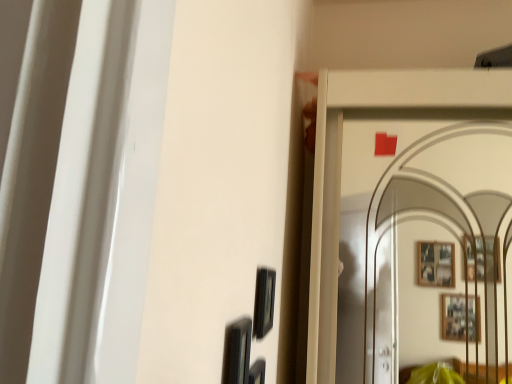
How much space does matte black picture frame at center, the second picture frame in the front-to-back sequence, occupy vertically?

It is 5.50 inches.

In order to click on matte black picture frame at center, the second picture frame in the front-to-back sequence in this screenshot , I will do `click(264, 301)`.

Describe the element at coordinates (264, 301) in the screenshot. I see `matte black picture frame at center, positioned as the 1th picture frame in back-to-front order` at that location.

What do you see at coordinates (237, 352) in the screenshot?
I see `black glossy picture frame at lower center, the second picture frame positioned from the back` at bounding box center [237, 352].

Locate an element on the screen. This screenshot has width=512, height=384. black glossy picture frame at lower center, the second picture frame positioned from the back is located at coordinates (237, 352).

What are the coordinates of `matte black picture frame at center, the second picture frame in the front-to-back sequence` in the screenshot? It's located at (264, 301).

Which is more to the left, black glossy picture frame at lower center, the second picture frame positioned from the back, or matte black picture frame at center, the second picture frame in the front-to-back sequence?

Positioned to the left is black glossy picture frame at lower center, the second picture frame positioned from the back.

Considering their positions, is black glossy picture frame at lower center, the second picture frame positioned from the back, located in front of or behind matte black picture frame at center, the second picture frame in the front-to-back sequence?

black glossy picture frame at lower center, the second picture frame positioned from the back, is positioned closer to the viewer than matte black picture frame at center, the second picture frame in the front-to-back sequence.

Considering the positions of points (236, 337) and (274, 276), is point (236, 337) closer to camera compared to point (274, 276)?

Yes, point (236, 337) is closer to viewer.

From the image's perspective, between black glossy picture frame at lower center, acting as the 1th picture frame starting from the front, and matte black picture frame at center, positioned as the 1th picture frame in back-to-front order, which one is located above?

From the image's view, matte black picture frame at center, positioned as the 1th picture frame in back-to-front order, is above.

From a real-world perspective, is black glossy picture frame at lower center, the second picture frame positioned from the back, above or below matte black picture frame at center, positioned as the 1th picture frame in back-to-front order?

black glossy picture frame at lower center, the second picture frame positioned from the back, is below matte black picture frame at center, positioned as the 1th picture frame in back-to-front order.

Does black glossy picture frame at lower center, acting as the 1th picture frame starting from the front, have a lesser width compared to matte black picture frame at center, the second picture frame in the front-to-back sequence?

Incorrect, the width of black glossy picture frame at lower center, acting as the 1th picture frame starting from the front, is not less than that of matte black picture frame at center, the second picture frame in the front-to-back sequence.

Considering the sizes of objects black glossy picture frame at lower center, the second picture frame positioned from the back, and matte black picture frame at center, the second picture frame in the front-to-back sequence, in the image provided, who is shorter, black glossy picture frame at lower center, the second picture frame positioned from the back, or matte black picture frame at center, the second picture frame in the front-to-back sequence,?

With less height is matte black picture frame at center, the second picture frame in the front-to-back sequence.

Between black glossy picture frame at lower center, the second picture frame positioned from the back, and matte black picture frame at center, the second picture frame in the front-to-back sequence, which one has larger size?

black glossy picture frame at lower center, the second picture frame positioned from the back.

Is matte black picture frame at center, the second picture frame in the front-to-back sequence, a part of black glossy picture frame at lower center, acting as the 1th picture frame starting from the front?

Definitely not — matte black picture frame at center, the second picture frame in the front-to-back sequence, is not inside black glossy picture frame at lower center, acting as the 1th picture frame starting from the front.

Is black glossy picture frame at lower center, the second picture frame positioned from the back, next to matte black picture frame at center, positioned as the 1th picture frame in back-to-front order?

No, black glossy picture frame at lower center, the second picture frame positioned from the back, is not making contact with matte black picture frame at center, positioned as the 1th picture frame in back-to-front order.

Is black glossy picture frame at lower center, the second picture frame positioned from the back, oriented away from matte black picture frame at center, the second picture frame in the front-to-back sequence?

That's not correct — black glossy picture frame at lower center, the second picture frame positioned from the back, is not looking away from matte black picture frame at center, the second picture frame in the front-to-back sequence.

The height and width of the screenshot is (384, 512). In the image, there is a matte black picture frame at center, positioned as the 1th picture frame in back-to-front order. What are the coordinates of `picture frame below it (from the image's perspective)` in the screenshot? It's located at (237, 352).

Is matte black picture frame at center, the second picture frame in the front-to-back sequence, to the right of black glossy picture frame at lower center, the second picture frame positioned from the back, from the viewer's perspective?

Yes, matte black picture frame at center, the second picture frame in the front-to-back sequence, is to the right of black glossy picture frame at lower center, the second picture frame positioned from the back.

Consider the image. Considering the relative positions of matte black picture frame at center, positioned as the 1th picture frame in back-to-front order, and black glossy picture frame at lower center, the second picture frame positioned from the back, in the image provided, is matte black picture frame at center, positioned as the 1th picture frame in back-to-front order, behind black glossy picture frame at lower center, the second picture frame positioned from the back,?

Yes, matte black picture frame at center, positioned as the 1th picture frame in back-to-front order, is further from the camera.

Which is closer to the camera, (263, 320) or (239, 339)?

The point (239, 339) is closer to the camera.

From the image's perspective, which is below, matte black picture frame at center, the second picture frame in the front-to-back sequence, or black glossy picture frame at lower center, acting as the 1th picture frame starting from the front?

black glossy picture frame at lower center, acting as the 1th picture frame starting from the front, from the image's perspective.

From a real-world perspective, is matte black picture frame at center, the second picture frame in the front-to-back sequence, on top of black glossy picture frame at lower center, acting as the 1th picture frame starting from the front?

Yes, from a real-world perspective, matte black picture frame at center, the second picture frame in the front-to-back sequence, is on top of black glossy picture frame at lower center, acting as the 1th picture frame starting from the front.

Between matte black picture frame at center, the second picture frame in the front-to-back sequence, and black glossy picture frame at lower center, acting as the 1th picture frame starting from the front, which one has larger width?

black glossy picture frame at lower center, acting as the 1th picture frame starting from the front.

Is matte black picture frame at center, the second picture frame in the front-to-back sequence, taller or shorter than black glossy picture frame at lower center, the second picture frame positioned from the back?

Clearly, matte black picture frame at center, the second picture frame in the front-to-back sequence, is shorter compared to black glossy picture frame at lower center, the second picture frame positioned from the back.

Is matte black picture frame at center, the second picture frame in the front-to-back sequence, bigger than black glossy picture frame at lower center, the second picture frame positioned from the back?

No.

Would you say matte black picture frame at center, positioned as the 1th picture frame in back-to-front order, contains black glossy picture frame at lower center, the second picture frame positioned from the back?

No, black glossy picture frame at lower center, the second picture frame positioned from the back, is not a part of matte black picture frame at center, positioned as the 1th picture frame in back-to-front order.

Is matte black picture frame at center, positioned as the 1th picture frame in back-to-front order, placed right next to black glossy picture frame at lower center, the second picture frame positioned from the back?

matte black picture frame at center, positioned as the 1th picture frame in back-to-front order, and black glossy picture frame at lower center, the second picture frame positioned from the back, are not in contact.

Is matte black picture frame at center, positioned as the 1th picture frame in back-to-front order, oriented towards black glossy picture frame at lower center, acting as the 1th picture frame starting from the front?

No.

How many degrees apart are the facing directions of matte black picture frame at center, positioned as the 1th picture frame in back-to-front order, and black glossy picture frame at lower center, the second picture frame positioned from the back?

The facing directions of matte black picture frame at center, positioned as the 1th picture frame in back-to-front order, and black glossy picture frame at lower center, the second picture frame positioned from the back, are 0.0172 degrees apart.

Where is `picture frame below the matte black picture frame at center, positioned as the 1th picture frame in back-to-front order (from the image's perspective)`? This screenshot has width=512, height=384. picture frame below the matte black picture frame at center, positioned as the 1th picture frame in back-to-front order (from the image's perspective) is located at coordinates (237, 352).

This screenshot has height=384, width=512. Find the location of `picture frame below the matte black picture frame at center, the second picture frame in the front-to-back sequence (from a real-world perspective)`. picture frame below the matte black picture frame at center, the second picture frame in the front-to-back sequence (from a real-world perspective) is located at coordinates (237, 352).

You are a GUI agent. You are given a task and a screenshot of the screen. Output one action in this format:
    pyautogui.click(x=<x>, y=<y>)
    Task: Click on the picture frame located on the right of black glossy picture frame at lower center, acting as the 1th picture frame starting from the front
    The width and height of the screenshot is (512, 384).
    Given the screenshot: What is the action you would take?
    pyautogui.click(x=264, y=301)